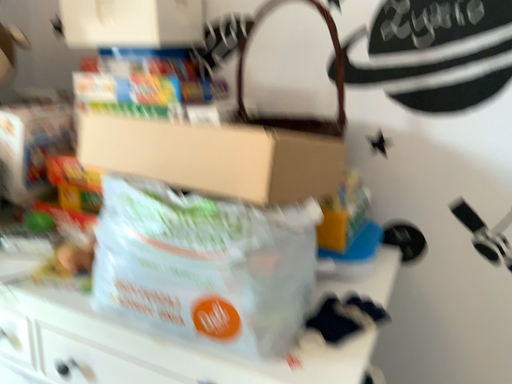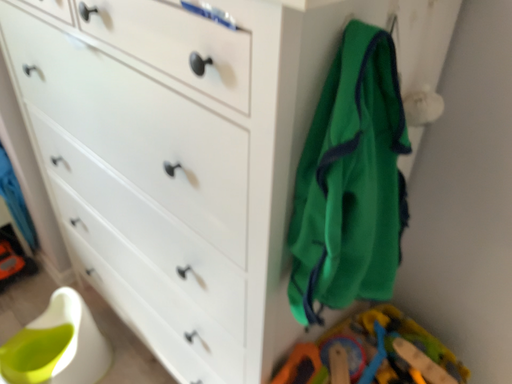
Question: How did the camera likely rotate when shooting the video?

Choices:
 (A) rotated left
 (B) rotated right

Answer: (A)